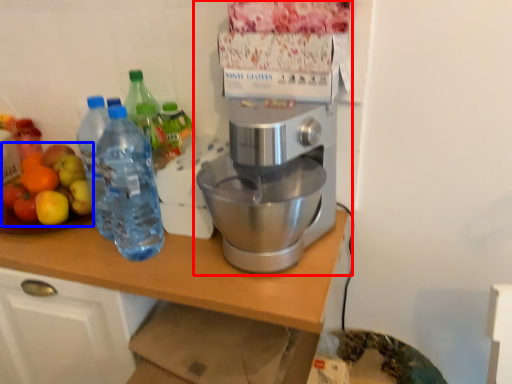
Question: Which object is further to the camera taking this photo, coffee maker (highlighted by a red box) or fruit salad (highlighted by a blue box)?

Choices:
 (A) coffee maker
 (B) fruit salad

Answer: (B)